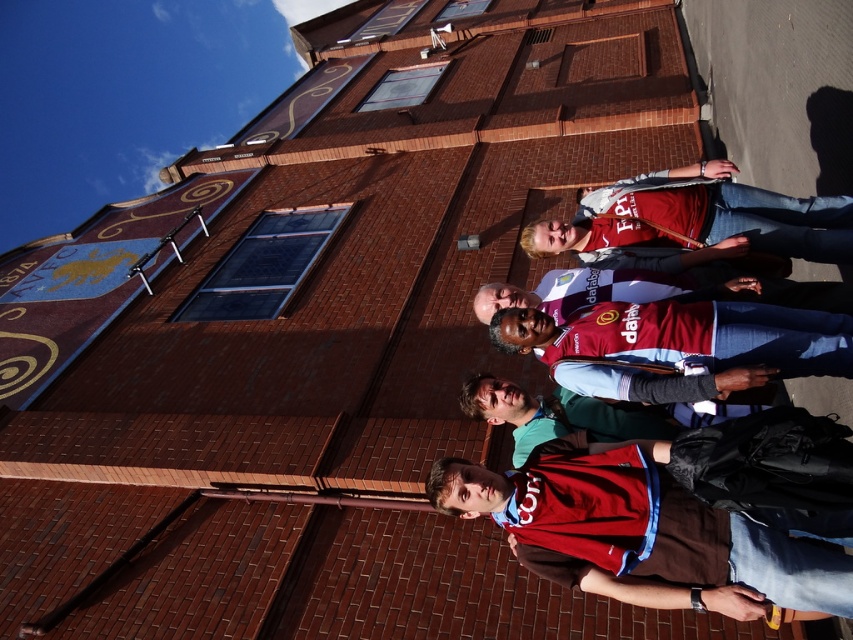
You are standing in front of the brick building and want to take a photo that includes both the point at coordinates [788,593] and the point at [689,237]. Which point should you focus on first to ensure both are in focus?

You should focus on point [689,237] first because it is farther from the camera than point [788,593], so focusing on the farther point will help ensure both are in focus.

You are a photographer trying to capture a clear shot of both the matte red jersey at center and the matte red shirt at center. Since they are both red, you need to adjust your focus to ensure both are visible. Which one should you focus on first to ensure it appears sharp in the photo?

You should focus on the matte red jersey at center first because it is closer to the viewer than the matte red shirt at center, so adjusting focus starting from the closer object ensures both can be in focus.